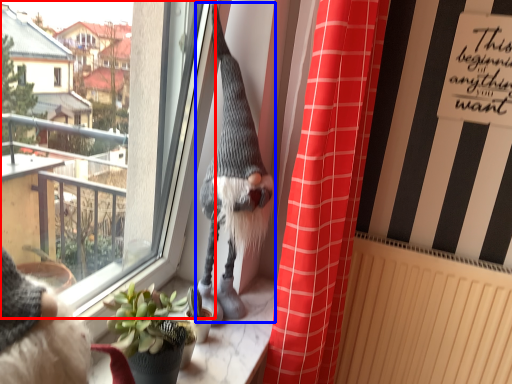
Question: Which point is closer to the camera, window (highlighted by a red box) or animal (highlighted by a blue box)?

Choices:
 (A) window
 (B) animal

Answer: (A)